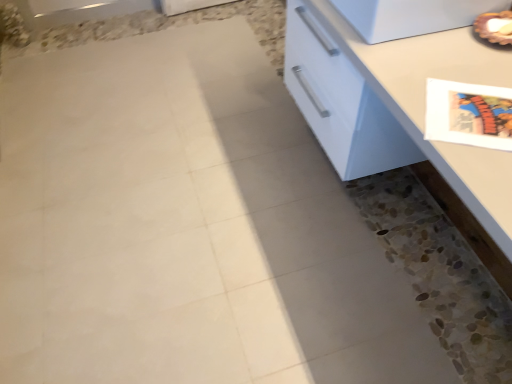
At what (x,y) coordinates should I click in order to perform the action: click on free space in front of white glossy refrigerator at upper right. Please return your answer as a coordinate pair (x, y). Looking at the image, I should click on (439, 69).